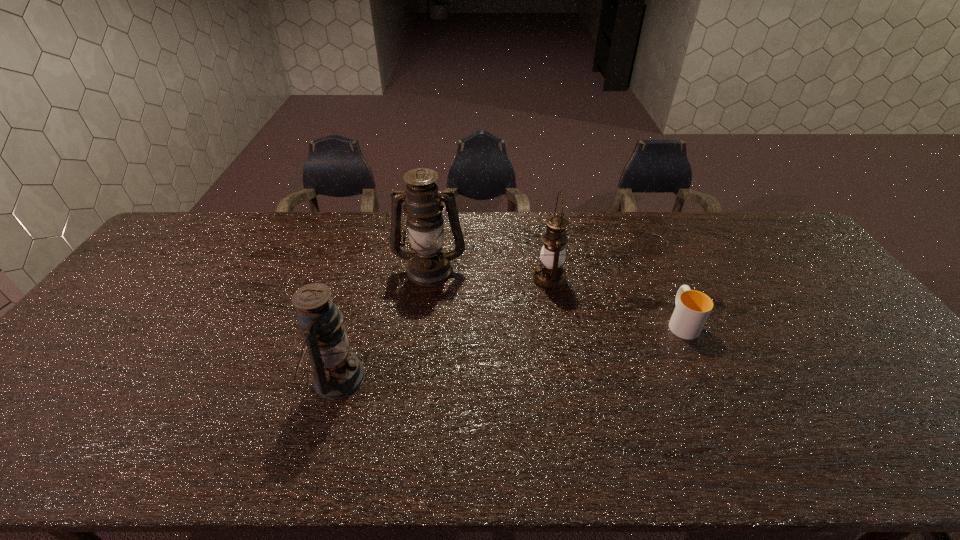
You are a GUI agent. You are given a task and a screenshot of the screen. Output one action in this format:
    pyautogui.click(x=<x>, y=<y>)
    Task: Click on the free location located with the handle on the side of the cup
    
    Given the screenshot: What is the action you would take?
    pyautogui.click(x=660, y=274)

Identify the location of vacant space located 0.180m with the handle on the side of the cup. (656, 265).

Identify the location of object located at the far edge. (429, 264).

Find the location of a particular element. The height and width of the screenshot is (540, 960). vacant region at the far edge of the desktop is located at coordinates (255, 230).

At what (x,y) coordinates should I click in order to perform the action: click on vacant space at the near edge of the desktop. Please return your answer as a coordinate pair (x, y). The image size is (960, 540). Looking at the image, I should click on (610, 444).

This screenshot has width=960, height=540. What are the coordinates of `free spot at the right edge of the desktop` in the screenshot? It's located at (781, 272).

Find the location of a particular element. This screenshot has height=540, width=960. free space at the far left corner of the desktop is located at coordinates (228, 216).

Image resolution: width=960 pixels, height=540 pixels. Find the location of `vacant point at the near left corner`. vacant point at the near left corner is located at coordinates (39, 461).

Image resolution: width=960 pixels, height=540 pixels. Identify the location of vacant space at the far right corner of the desktop. (789, 243).

Identify the location of vacant region between the third object from right to left and the cup. (556, 295).